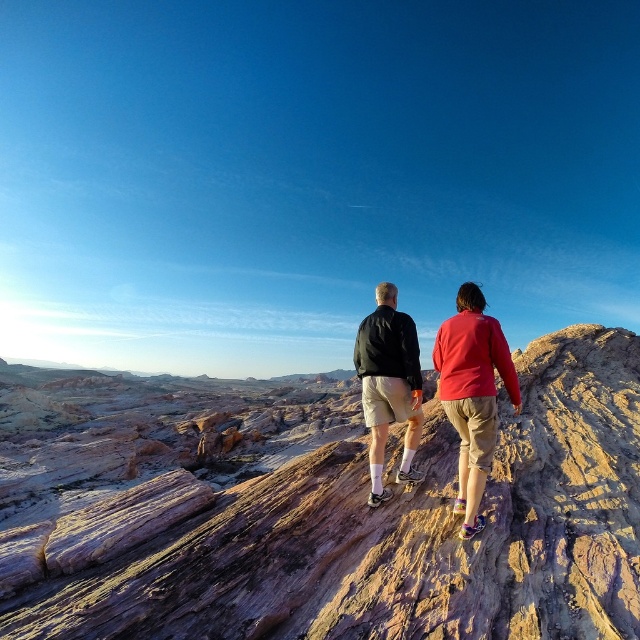
Who is more forward, (179, 573) or (468, 380)?

Point (179, 573) is more forward.

Does rustic stone mountain at center come in front of matte black jacket at center?

Yes, rustic stone mountain at center is in front of matte black jacket at center.

The width and height of the screenshot is (640, 640). I want to click on rustic stone mountain at center, so click(404, 534).

Identify the location of rustic stone mountain at center. (404, 534).

Which is behind, point (276, 556) or point (406, 426)?

The point (406, 426) is behind.

Is rustic stone mountain at center positioned before black matte jacket at center?

Yes, rustic stone mountain at center is in front of black matte jacket at center.

Locate an element on the screen. The height and width of the screenshot is (640, 640). rustic stone mountain at center is located at coordinates click(404, 534).

Measure the distance between matte black jacket at center and camera.

The distance of matte black jacket at center from camera is 6.72 meters.

Which of these two, matte black jacket at center or black matte jacket at center, stands taller?

Standing taller between the two is matte black jacket at center.

Locate an element on the screen. matte black jacket at center is located at coordinates (472, 394).